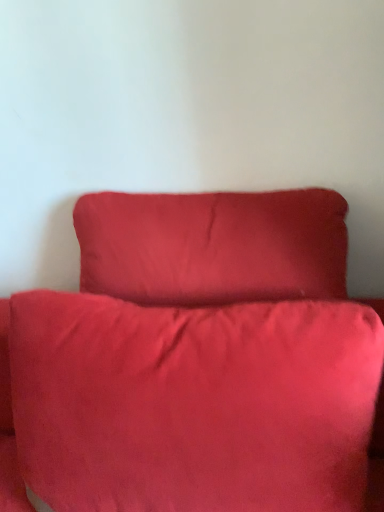
Locate an element on the screen. The image size is (384, 512). matte red pillow at center is located at coordinates (193, 404).

The width and height of the screenshot is (384, 512). What do you see at coordinates (193, 404) in the screenshot?
I see `matte red pillow at center` at bounding box center [193, 404].

The height and width of the screenshot is (512, 384). What are the coordinates of `matte red pillow at center` in the screenshot? It's located at (193, 404).